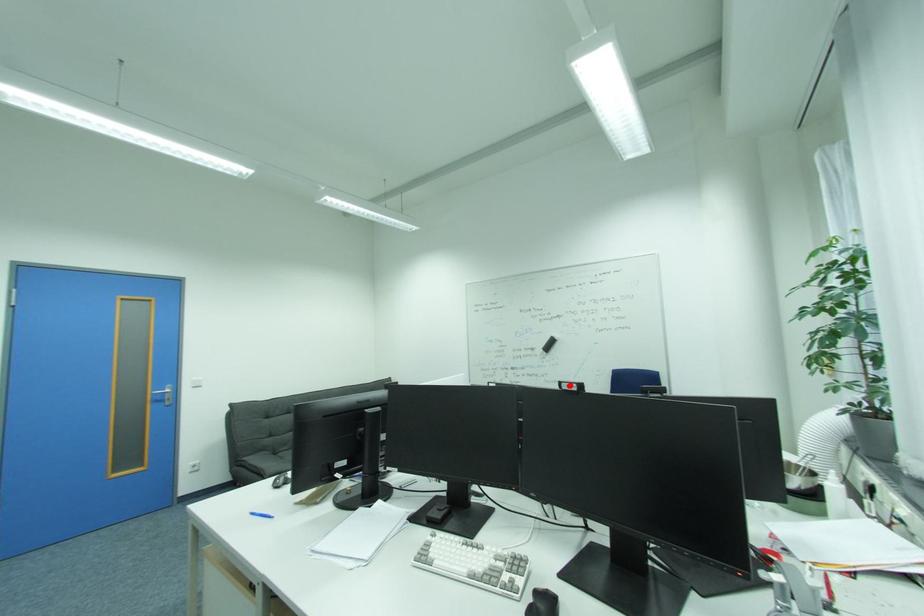
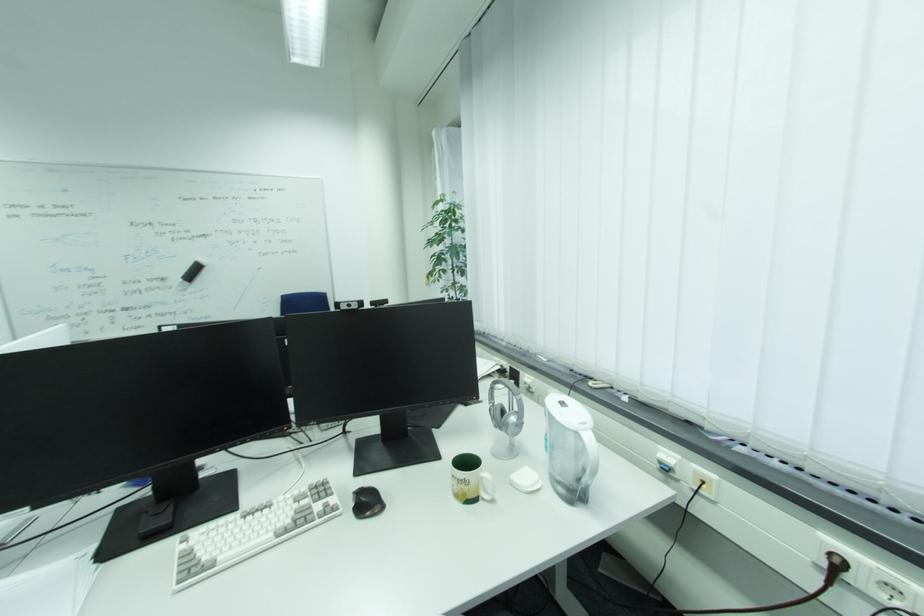
Where in the second image is the point corresponding to the highlighted location from the first image?

(348, 304)